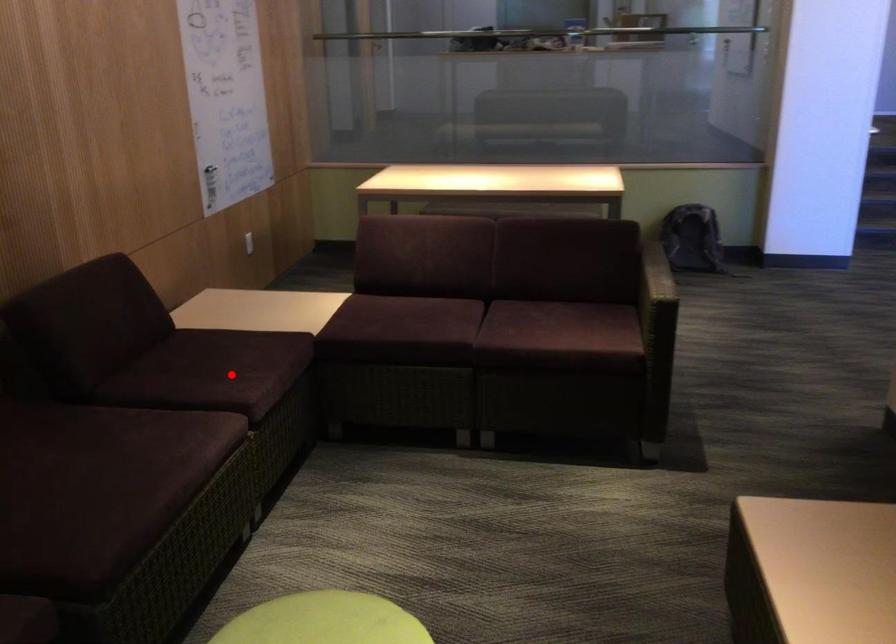
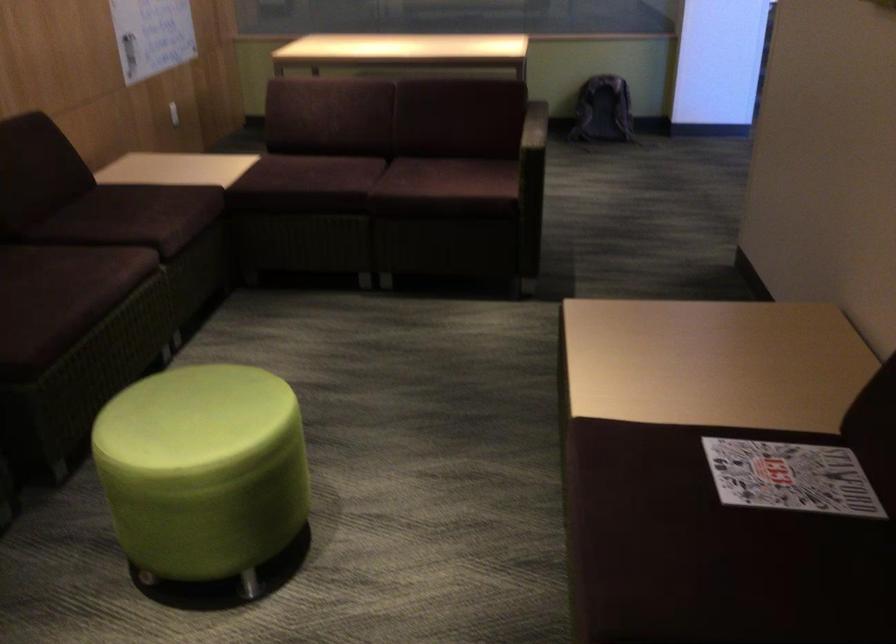
Question: I am providing you with two images of the same scene from different viewpoints. A red point is shown in image1. For the corresponding object point in image2, is it positioned nearer or farther from the camera?

Choices:
 (A) Nearer
 (B) Farther

Answer: (B)